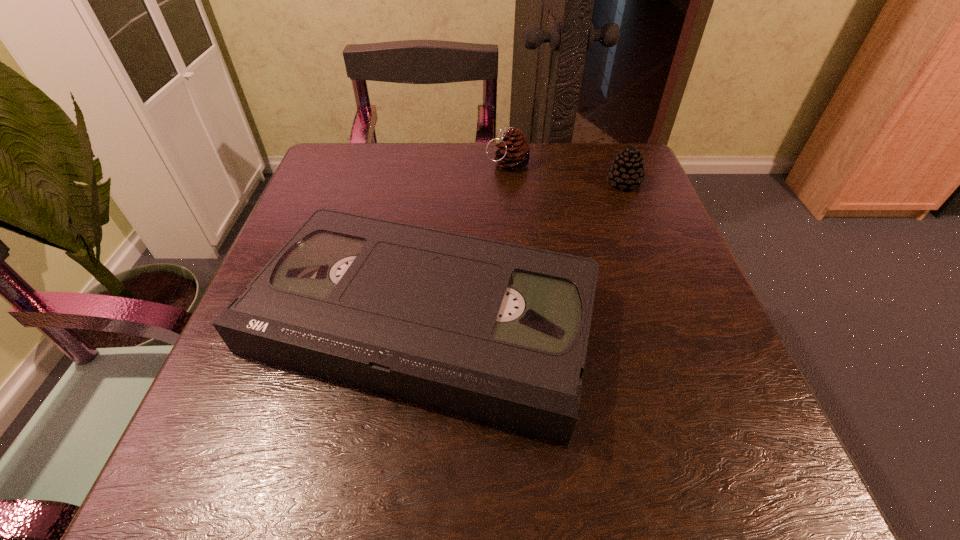
Where is `free space at the far right corner`? The image size is (960, 540). free space at the far right corner is located at coordinates (646, 174).

You are a GUI agent. You are given a task and a screenshot of the screen. Output one action in this format:
    pyautogui.click(x=<x>, y=<y>)
    Task: Click on the unoccupied position between the left pinecone and the rightmost object
    The width and height of the screenshot is (960, 540).
    Given the screenshot: What is the action you would take?
    pyautogui.click(x=565, y=173)

You are a GUI agent. You are given a task and a screenshot of the screen. Output one action in this format:
    pyautogui.click(x=<x>, y=<y>)
    Task: Click on the free space between the rightmost object and the left pinecone
    The height and width of the screenshot is (540, 960).
    Given the screenshot: What is the action you would take?
    pyautogui.click(x=565, y=173)

Find the location of a particular element. The width and height of the screenshot is (960, 540). vacant area that lies between the left pinecone and the right pinecone is located at coordinates (565, 173).

You are a GUI agent. You are given a task and a screenshot of the screen. Output one action in this format:
    pyautogui.click(x=<x>, y=<y>)
    Task: Click on the free space between the rightmost object and the left pinecone
    
    Given the screenshot: What is the action you would take?
    pyautogui.click(x=565, y=173)

You are a GUI agent. You are given a task and a screenshot of the screen. Output one action in this format:
    pyautogui.click(x=<x>, y=<y>)
    Task: Click on the object that is the closest to the rightmost object
    Image resolution: width=960 pixels, height=540 pixels.
    Given the screenshot: What is the action you would take?
    pyautogui.click(x=514, y=150)

Where is `object that stands as the second closest to the videotape`? The height and width of the screenshot is (540, 960). object that stands as the second closest to the videotape is located at coordinates [x=514, y=150].

You are a GUI agent. You are given a task and a screenshot of the screen. Output one action in this format:
    pyautogui.click(x=<x>, y=<y>)
    Task: Click on the vacant area that satisfies the following two spatial constraints: 1. with a leaf charm attached to the left pinecone; 2. on the front side of the videotape
    The width and height of the screenshot is (960, 540).
    Given the screenshot: What is the action you would take?
    pyautogui.click(x=520, y=320)